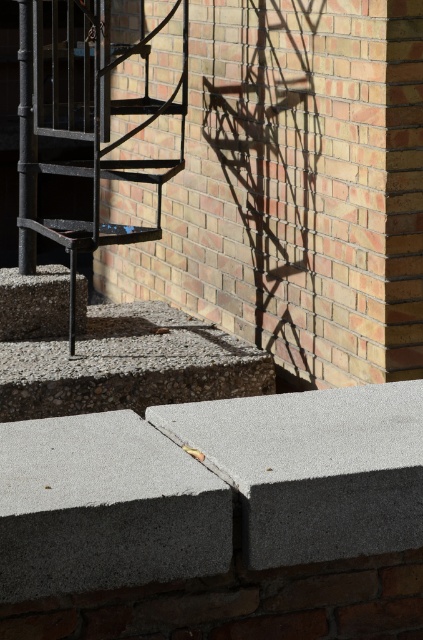
Is black metal fire escape at left to the right of gray rough concrete at center from the viewer's perspective?

No, black metal fire escape at left is not to the right of gray rough concrete at center.

Who is positioned more to the right, black metal fire escape at left or gray rough concrete at center?

Positioned to the right is gray rough concrete at center.

Does point (88, 72) come closer to viewer compared to point (131, 353)?

No, (88, 72) is behind (131, 353).

In order to click on black metal fire escape at left in this screenshot , I will do `click(82, 120)`.

Does gray concrete at lower right appear under black metal fire escape at left?

Correct, gray concrete at lower right is located below black metal fire escape at left.

Describe the element at coordinates (104, 508) in the screenshot. This screenshot has height=640, width=423. I see `gray concrete at lower right` at that location.

Where is `gray concrete at lower right`? gray concrete at lower right is located at coordinates (104, 508).

Is gray concrete at center thinner than gray rough concrete at center?

Yes.

Is point (308, 417) farther from camera compared to point (173, 344)?

No, (308, 417) is closer to viewer.

The width and height of the screenshot is (423, 640). What are the coordinates of `gray concrete at center` in the screenshot? It's located at (313, 467).